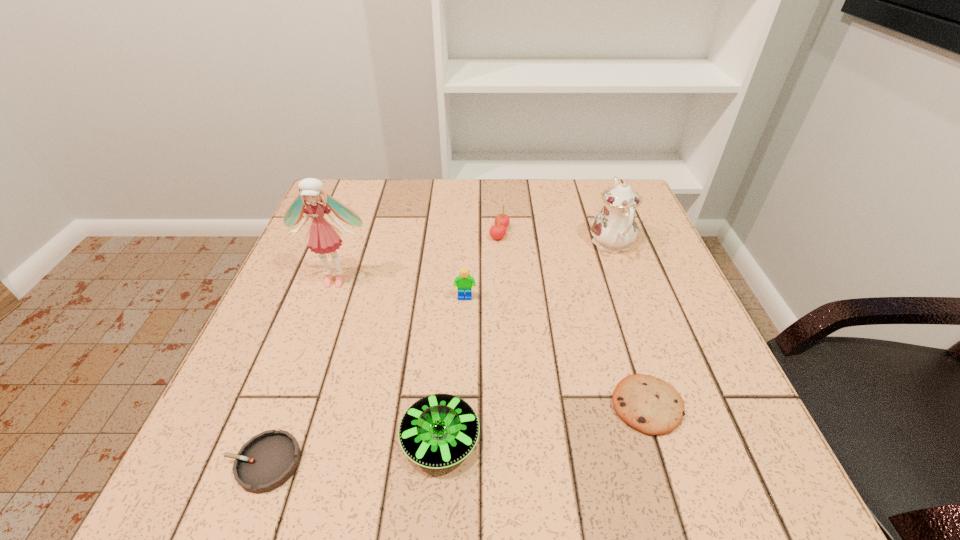
Identify the location of vacant point located on the front of the chinaware. (646, 339).

This screenshot has width=960, height=540. Identify the location of vacant space situated on the face of the fourth nearest object. (463, 352).

The width and height of the screenshot is (960, 540). I want to click on vacant space located on the back of the cherry, so click(x=497, y=191).

I want to click on vacant space located on the right of the saucer, so click(x=711, y=439).

Where is `vacant area located 0.090m on the left of the sixth tallest object`? vacant area located 0.090m on the left of the sixth tallest object is located at coordinates (559, 406).

This screenshot has height=540, width=960. In order to click on vacant space located on the right of the shortest object in this screenshot , I will do `click(365, 462)`.

Identify the location of chinaware at the far edge. This screenshot has height=540, width=960. (614, 228).

Locate an element on the screen. cherry that is at the far edge is located at coordinates (497, 231).

The image size is (960, 540). I want to click on saucer located in the near edge section of the desktop, so click(440, 430).

You are a GUI agent. You are given a task and a screenshot of the screen. Output one action in this format:
    pyautogui.click(x=<x>, y=<y>)
    Task: Click on the ashtray located in the near edge section of the desktop
    The image size is (960, 540).
    Given the screenshot: What is the action you would take?
    pyautogui.click(x=265, y=462)